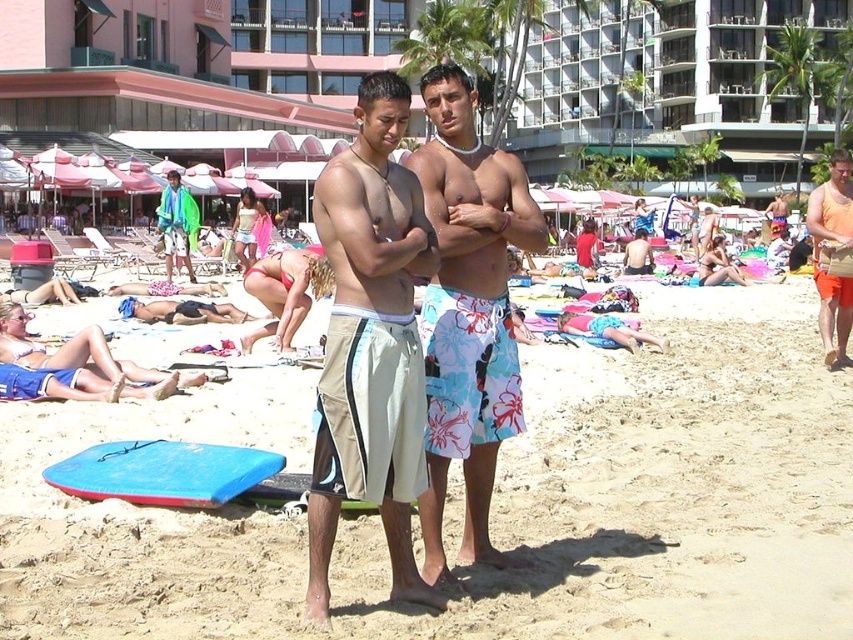
Question: Which of the following is the closest to the observer?

Choices:
 (A) (415, 166)
 (B) (173, 257)
 (C) (590, 234)
 (D) (170, 477)

Answer: (A)

Question: Is beige sand at center further to the viewer compared to floral print shorts at center?

Choices:
 (A) yes
 (B) no

Answer: (B)

Question: Does blue foam surfboard at lower left appear under orange tank top at right?

Choices:
 (A) no
 (B) yes

Answer: (B)

Question: Which point appears farthest from the camera in this image?

Choices:
 (A) (238, 499)
 (B) (786, 470)
 (C) (383, 496)

Answer: (B)

Question: Can you confirm if floral swim trunks at center is positioned to the left of matte blue shorts at center?

Choices:
 (A) no
 (B) yes

Answer: (B)

Question: Which point is closer to the camera taking this photo?

Choices:
 (A) (798, 326)
 (B) (589, 257)
 (C) (653, 259)
 (D) (340, 193)

Answer: (D)